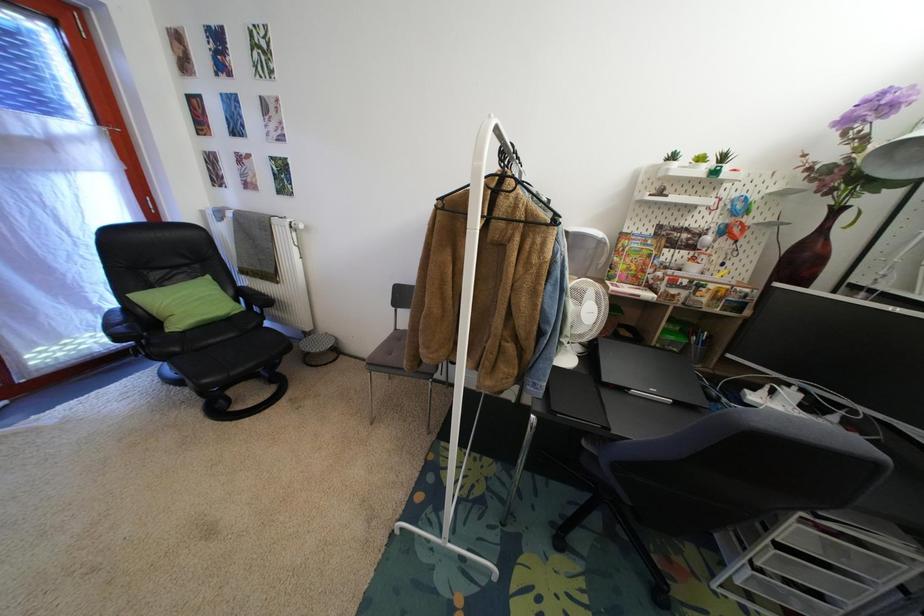
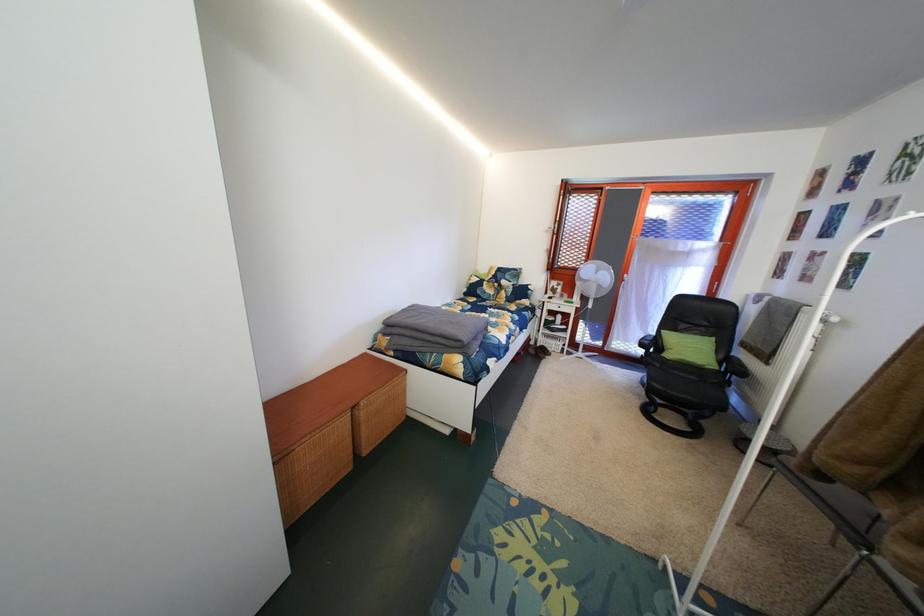
Question: The images are taken continuously from a first-person perspective. In which direction is your viewpoint rotating?

Choices:
 (A) Left
 (B) Right
 (C) Up
 (D) Down

Answer: (A)